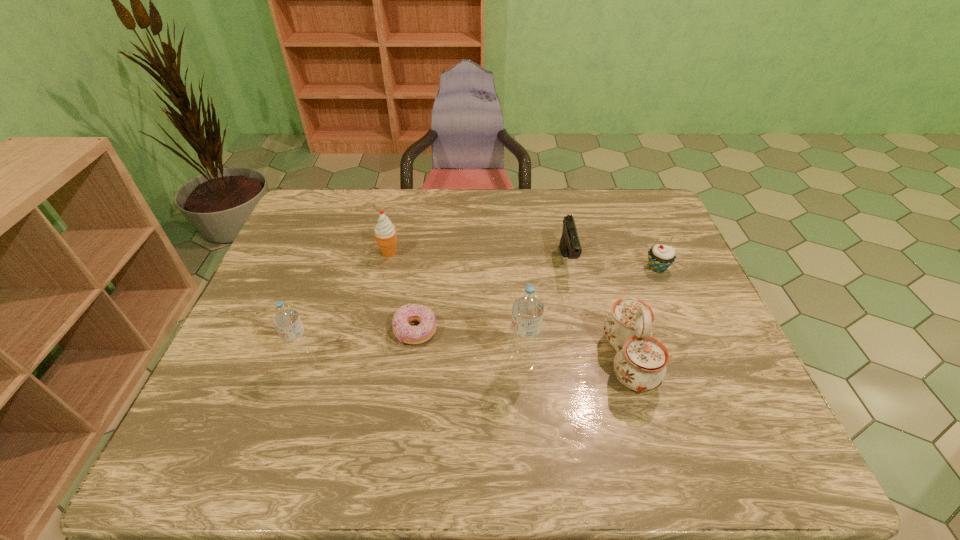
Please point a spot on the right to add another water bottle. Please provide its 2D coordinates. Your answer should be formatted as a tuple, i.e. [(x, y)], where the tuple contains the x and y coordinates of a point satisfying the conditions above.

[(741, 364)]